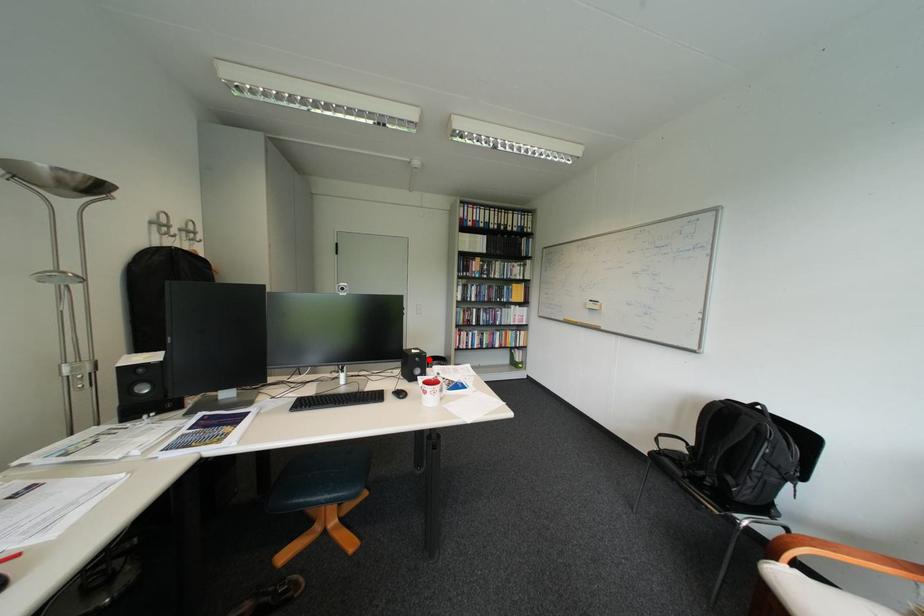
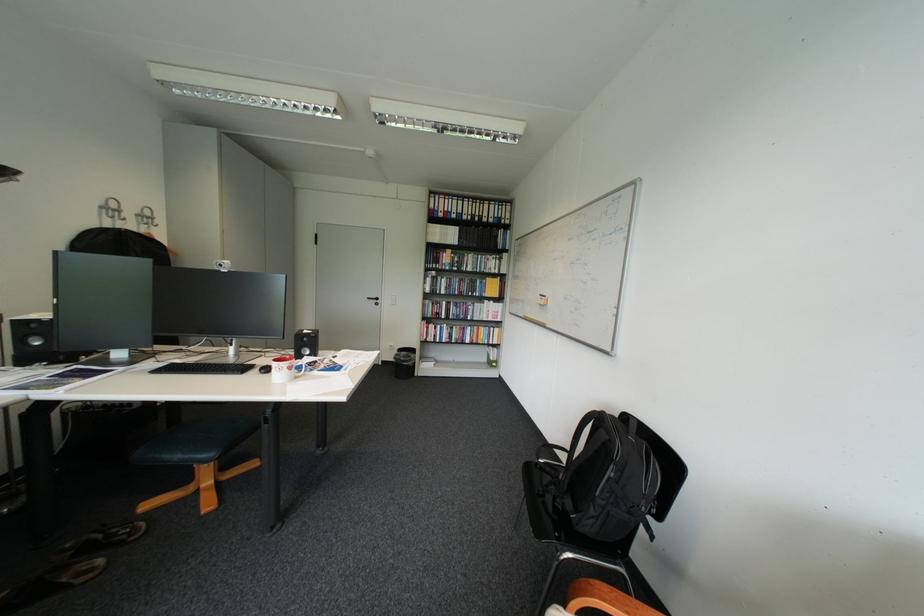
In the second image, find the point that corresponds to the highlighted location in the first image.

(317, 339)